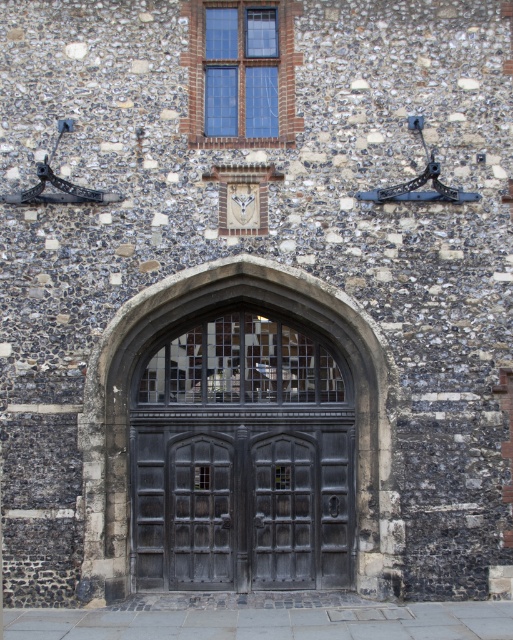
You are standing in front of the historic building and want to take a photo. There are two points marked on the wall at coordinates point (390, 515) and point (274, 90). Which point will appear larger in your photo?

Point (390, 515) is closer to the camera than point (274, 90), so it will appear larger in the photo.

You are an architect examining the historic building. You notice the dark gray stone archway at center and the clear glass window at upper center. Which of these two elements is located higher up on the wall?

The clear glass window at upper center is located higher up on the wall than the dark gray stone archway at center.

You are an architect examining the historic building. You need to determine the spatial relationship between the dark gray stone archway at center and the dark wood door at center. Which object is located to the right of the other?

The dark gray stone archway at center is positioned on the right side of dark wood door at center, meaning the archway is to the right of the door.